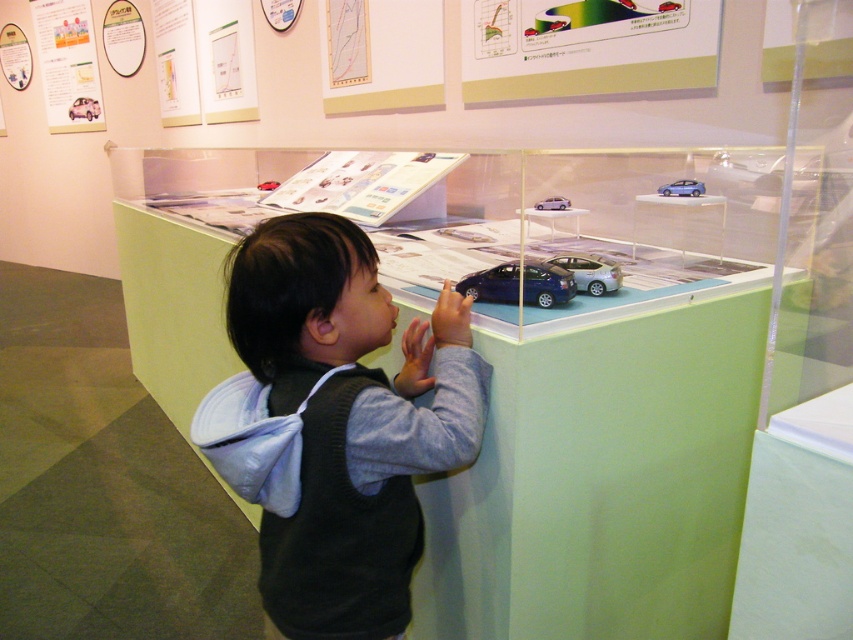
You are a toy store employee who needs to ensure all cars in the display case are visible to customers. The satin silver car at center and the metallic blue car at upper center are two of the cars in the case. Which car might be partially hidden by the other due to their sizes?

The metallic blue car at upper center might be partially hidden because the satin silver car at center is taller than it.

You are a photographer trying to capture a closeup of the display case in the image. You notice two points marked on the case at coordinates point [296,500] and point [592,275]. Which point should you focus on to ensure the closest part of the display case is in sharp focus?

Point [296,500] is closer to the camera than point [592,275], so focusing on point [296,500] will ensure the closest part of the display case is in sharp focus.